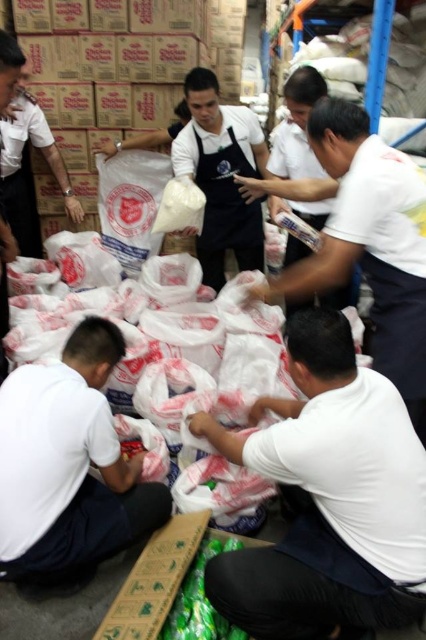
Is white plastic bag at lower right positioned before white matte apron at center?

Yes, it is in front of white matte apron at center.

Who is positioned more to the left, white plastic bag at lower right or white matte apron at center?

white plastic bag at lower right

Measure the distance between point (x=422, y=605) and camera.

Point (x=422, y=605) is 1.34 meters away from camera.

The height and width of the screenshot is (640, 426). Identify the location of white plastic bag at lower right. (328, 499).

Does white plastic bag at lower left appear over white matte apron at center?

No.

Which is below, white plastic bag at lower left or white matte apron at center?

white plastic bag at lower left is lower down.

Image resolution: width=426 pixels, height=640 pixels. What do you see at coordinates (69, 465) in the screenshot?
I see `white plastic bag at lower left` at bounding box center [69, 465].

This screenshot has width=426, height=640. Identify the location of white plastic bag at lower left. (69, 465).

Is the position of white matte plastic bag at upper center less distant than that of white matte apron at center?

That is True.

Is white matte plastic bag at upper center thinner than white matte apron at center?

No, white matte plastic bag at upper center is not thinner than white matte apron at center.

Is point (319, 248) closer to camera compared to point (287, 253)?

That is True.

You are a GUI agent. You are given a task and a screenshot of the screen. Output one action in this format:
    pyautogui.click(x=<x>, y=<y>)
    Task: Click on the white matte plastic bag at upper center
    This screenshot has width=426, height=640.
    Given the screenshot: What is the action you would take?
    pyautogui.click(x=370, y=243)